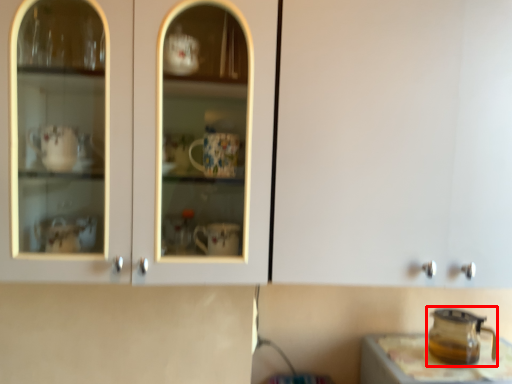
Question: From the image's perspective, where is appliance (annotated by the red box) located in relation to table in the image?

Choices:
 (A) above
 (B) below

Answer: (A)